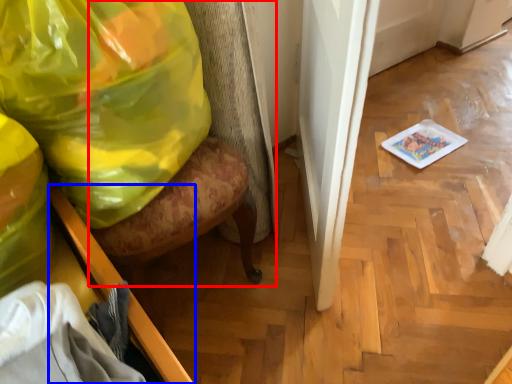
Question: Which object is closer to the camera taking this photo, swivel chair (highlighted by a red box) or furniture (highlighted by a blue box)?

Choices:
 (A) swivel chair
 (B) furniture

Answer: (B)